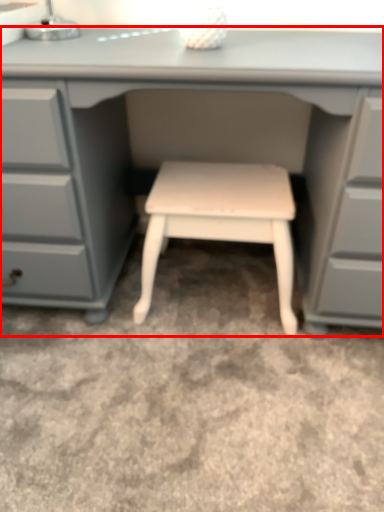
Question: In this image, where is desk (annotated by the red box) located relative to stool?

Choices:
 (A) right
 (B) left

Answer: (B)